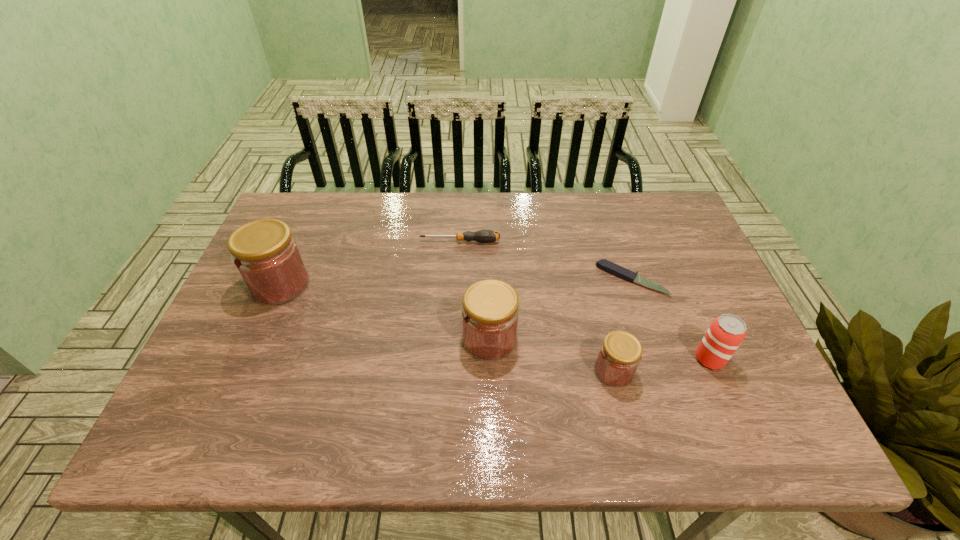
Find the location of `vacant position for inserting another jam evenly`. vacant position for inserting another jam evenly is located at coordinates (379, 310).